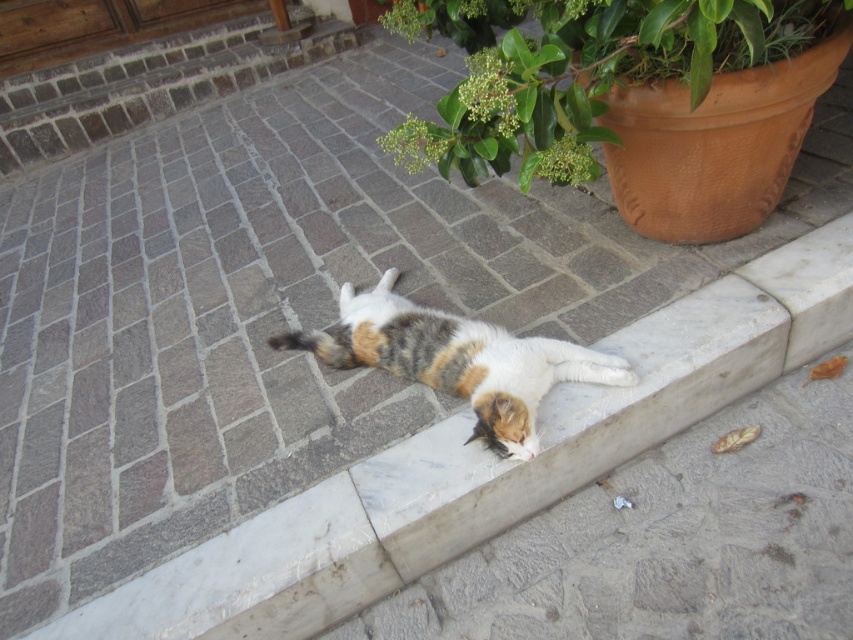
Question: Does green leafy plant at upper center have a greater width compared to calico fur cat at center?

Choices:
 (A) yes
 (B) no

Answer: (A)

Question: Does green leafy plant at upper center appear over calico fur cat at center?

Choices:
 (A) no
 (B) yes

Answer: (B)

Question: Which object appears farthest from the camera in this image?

Choices:
 (A) calico fur cat at center
 (B) green leafy plant at upper center

Answer: (A)

Question: Can you confirm if green leafy plant at upper center is positioned below calico fur cat at center?

Choices:
 (A) no
 (B) yes

Answer: (A)

Question: Which point is closer to the camera?

Choices:
 (A) (473, 339)
 (B) (505, 45)

Answer: (B)